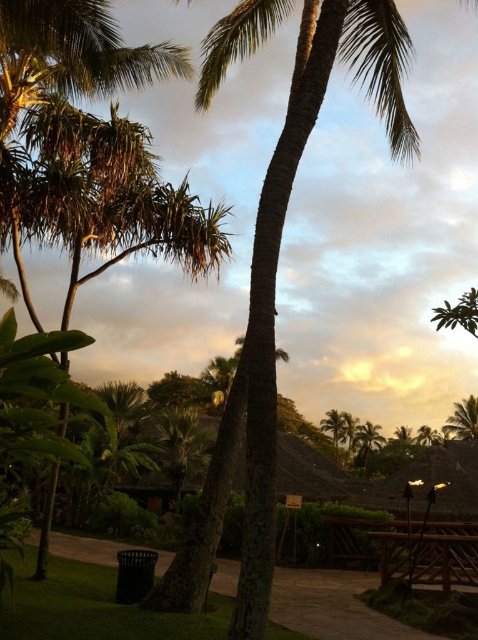
Between point (474, 426) and point (355, 435), which one is positioned behind?

Point (355, 435)

Describe the element at coordinates (463, 419) in the screenshot. Image resolution: width=478 pixels, height=640 pixels. I see `green leafy palm tree at lower right` at that location.

Who is more forward, (468, 396) or (377, 426)?

Point (468, 396)

At what (x,y) coordinates should I click in order to perform the action: click on green leafy palm tree at lower right. Please return your answer as a coordinate pair (x, y). Image resolution: width=478 pixels, height=640 pixels. Looking at the image, I should click on tap(463, 419).

Is brown wooden path at lower center positioned in front of green leafy palm tree at center?

That is True.

This screenshot has width=478, height=640. Find the location of `brown wooden path at lower center`. brown wooden path at lower center is located at coordinates (334, 605).

Does point (305, 600) come closer to viewer compared to point (368, 420)?

Yes, it is.

Image resolution: width=478 pixels, height=640 pixels. Identify the location of brown wooden path at lower center. (334, 605).

Based on the photo, can you confirm if green textured palm tree at center is positioned below green leafy palm tree at center?

No, green textured palm tree at center is not below green leafy palm tree at center.

Which of these two, green textured palm tree at center or green leafy palm tree at center, stands taller?

green textured palm tree at center

Image resolution: width=478 pixels, height=640 pixels. What do you see at coordinates (273, 301) in the screenshot?
I see `green textured palm tree at center` at bounding box center [273, 301].

The width and height of the screenshot is (478, 640). What are the coordinates of `green textured palm tree at center` in the screenshot? It's located at (273, 301).